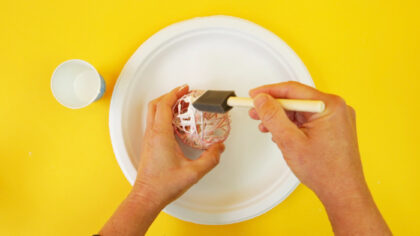
Image resolution: width=420 pixels, height=236 pixels. I want to click on table, so click(354, 50).